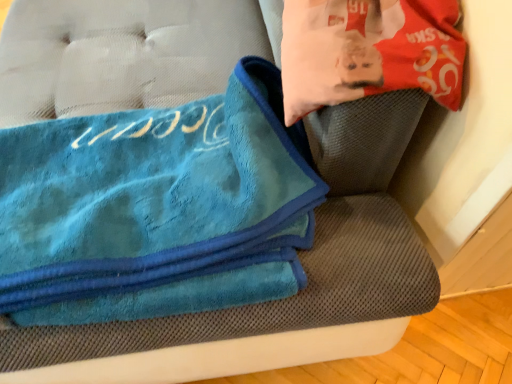
The image size is (512, 384). Find the location of `matte cotton t-shirt at upper right`. matte cotton t-shirt at upper right is located at coordinates (368, 51).

Describe the element at coordinates (368, 51) in the screenshot. I see `matte cotton t-shirt at upper right` at that location.

Locate an element on the screen. The height and width of the screenshot is (384, 512). matte cotton t-shirt at upper right is located at coordinates (368, 51).